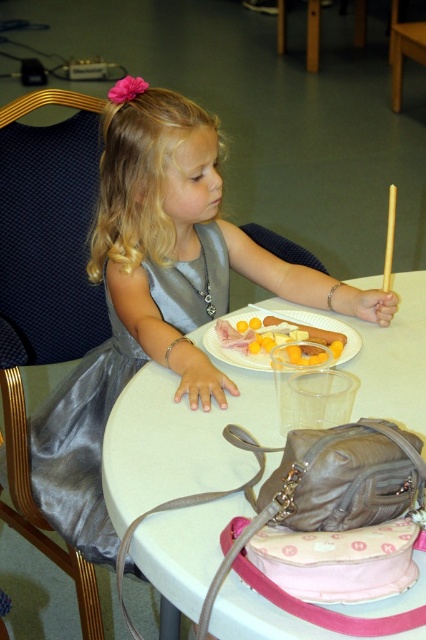
Does white plastic table at center come behind yellow cheese at center?

That is False.

Between point (373, 353) and point (290, 330), which one is positioned behind?

The point (290, 330) is more distant.

Which is behind, point (406, 294) or point (244, 321)?

Point (406, 294)

You are a GUI agent. You are given a task and a screenshot of the screen. Output one action in this format:
    pyautogui.click(x=<x>, y=<y>)
    Task: Click on the white plastic table at center
    
    Given the screenshot: What is the action you would take?
    pyautogui.click(x=405, y=349)

Is point (71, 488) farther from camera compared to point (253, 307)?

That is False.

Is point (46, 477) positioned behind point (236, 332)?

Yes, it is behind point (236, 332).

What are the coordinates of `satin dress at center` in the screenshot? It's located at (81, 444).

Can you confirm if silky silver dress at center is positioned above white plastic table at center?

Yes, silky silver dress at center is above white plastic table at center.

At what (x,y) coordinates should I click in order to perform the action: click on silky silver dress at center. Please return your answer as a coordinate pair (x, y). The height and width of the screenshot is (640, 426). Looking at the image, I should click on (157, 294).

Image resolution: width=426 pixels, height=640 pixels. I want to click on silky silver dress at center, so click(x=157, y=294).